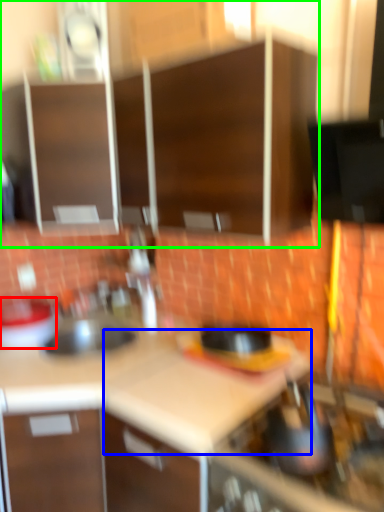
Question: Which is farther away from kitchen appliance (highlighted by a red box)? counter top (highlighted by a blue box) or cabinetry (highlighted by a green box)?

Choices:
 (A) counter top
 (B) cabinetry

Answer: (B)